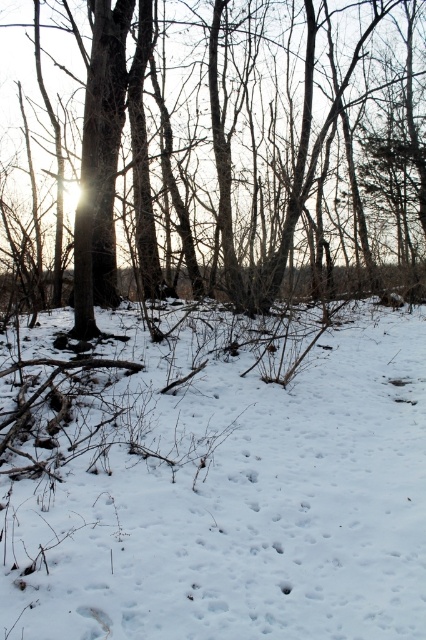
Question: In this image, where is white powdery snow at center located relative to brown rough tree at center?

Choices:
 (A) above
 (B) below

Answer: (B)

Question: Which point is closer to the camera?

Choices:
 (A) white powdery snow at center
 (B) brown rough tree at center

Answer: (A)

Question: Which point is farther from the camera taking this photo?

Choices:
 (A) (370, 536)
 (B) (229, 237)

Answer: (B)

Question: Is white powdery snow at center bigger than brown rough tree at center?

Choices:
 (A) yes
 (B) no

Answer: (B)

Question: Among these points, which one is farthest from the camera?

Choices:
 (A) (52, 490)
 (B) (236, 161)

Answer: (B)

Question: Is white powdery snow at center bigger than brown rough tree at center?

Choices:
 (A) yes
 (B) no

Answer: (B)